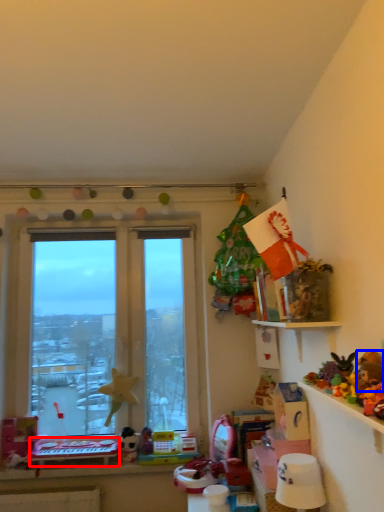
Question: Which object appears farthest to the camera in this image, table (highlighted by a red box) or toy (highlighted by a blue box)?

Choices:
 (A) table
 (B) toy

Answer: (A)